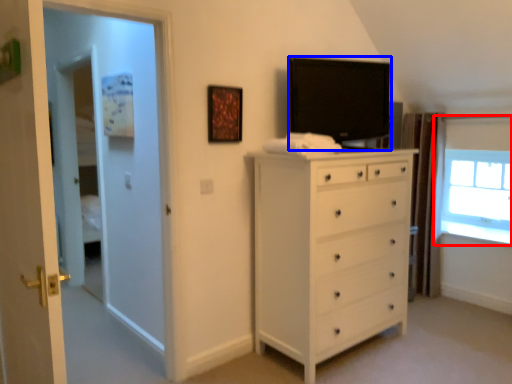
Question: Among these objects, which one is farthest to the camera, window (highlighted by a red box) or television (highlighted by a blue box)?

Choices:
 (A) window
 (B) television

Answer: (A)